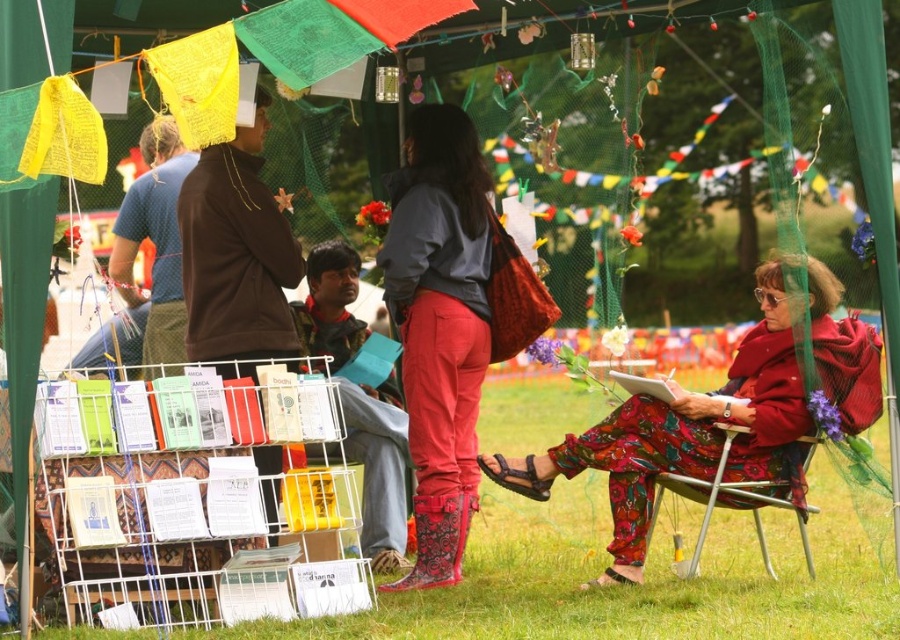
Question: Is rubber boots at center closer to camera compared to metallic silver chair at lower right?

Choices:
 (A) yes
 (B) no

Answer: (B)

Question: Which point is farther from the camera taking this photo?

Choices:
 (A) (703, 529)
 (B) (482, 467)
 (C) (390, 589)
 (D) (790, 573)

Answer: (B)

Question: Can you confirm if rubber boots at center is smaller than floral print dress at right?

Choices:
 (A) yes
 (B) no

Answer: (A)

Question: Is green grass at lower center to the left of floral print dress at right from the viewer's perspective?

Choices:
 (A) no
 (B) yes

Answer: (B)

Question: Which point is closer to the camera?

Choices:
 (A) (655, 448)
 (B) (462, 528)

Answer: (A)

Question: Which of the following is the closest to the observer?

Choices:
 (A) metallic silver chair at lower right
 (B) green grass at lower center

Answer: (A)